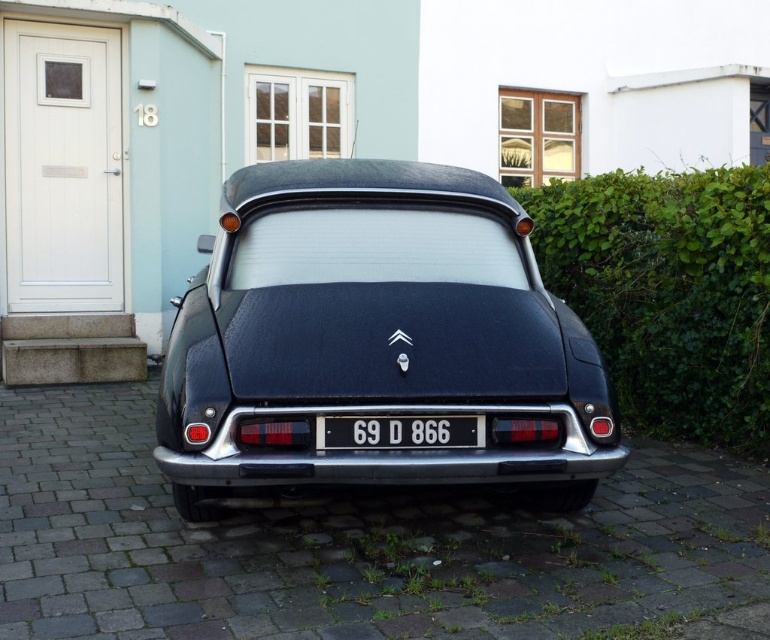
You are a photographer trying to capture the shiny black car at center and the black plastic license plate at center in a single shot. Which object should you focus on first to ensure both are in frame without moving the camera?

The shiny black car at center is much taller than the black plastic license plate at center, so you should focus on the taller object first to ensure both are in frame without moving the camera.

You are standing at the rear of the vintage Citroen car and looking towards the front. There are two points marked on the car. One is at point [548,380] and the other at point [340,420]. Which point is closer to the front of the car?

Point [340,420] is closer to the front of the car because it is in front of point [548,380].